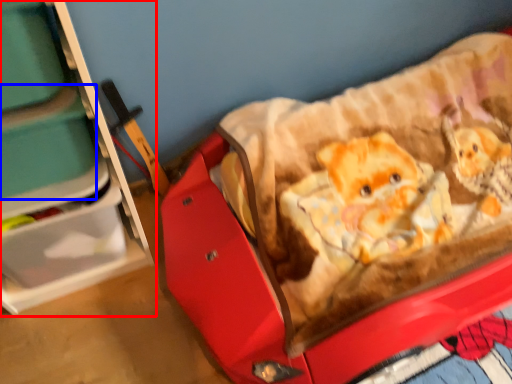
Question: Which object is closer to the camera taking this photo, furniture (highlighted by a red box) or storage box (highlighted by a blue box)?

Choices:
 (A) furniture
 (B) storage box

Answer: (A)